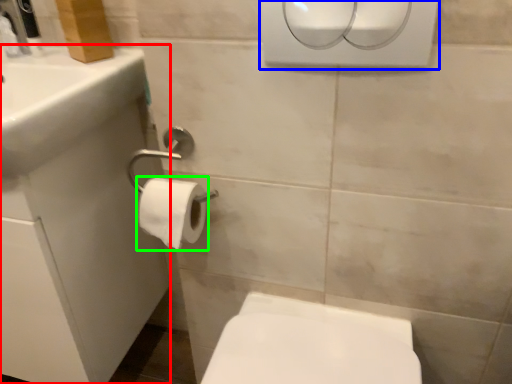
Question: Which is farther away from porcelain (highlighted by a red box)? hand dryer (highlighted by a blue box) or toilet paper (highlighted by a green box)?

Choices:
 (A) hand dryer
 (B) toilet paper

Answer: (A)